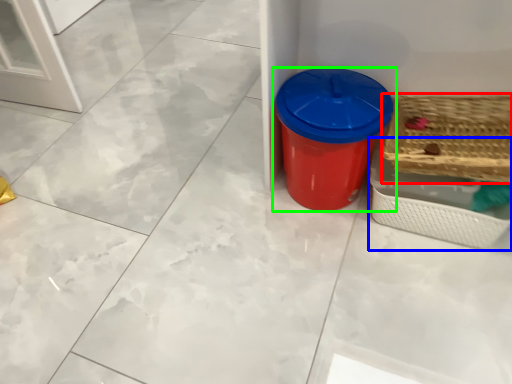
Question: Which object is positioned farthest from basket (highlighted by a red box)? Select from basket (highlighted by a blue box) and waste container (highlighted by a green box).

Choices:
 (A) basket
 (B) waste container

Answer: (B)